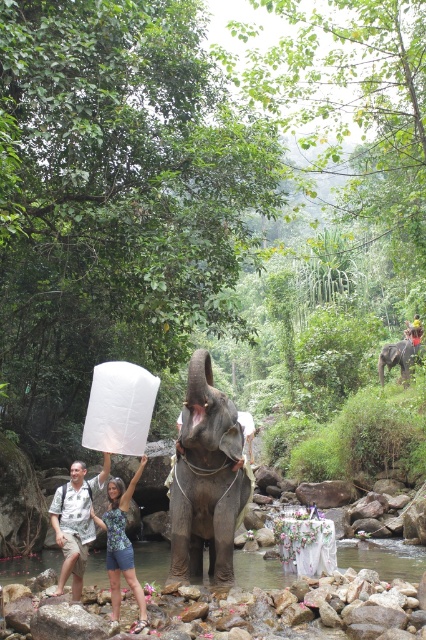
Where is the printed cotton shirt at center located in the image?

The printed cotton shirt at center is located at point (x=75, y=522) in the image.

You are standing on the riverbank and want to cross to the other side using the clear water at river center. However, you notice the gray textured elephant at center is blocking your path. Can you walk around the elephant to reach the water safely?

The gray textured elephant at center is to the right of clear water at river center, so you can walk to the left side of the elephant to reach the clear water at river center safely.